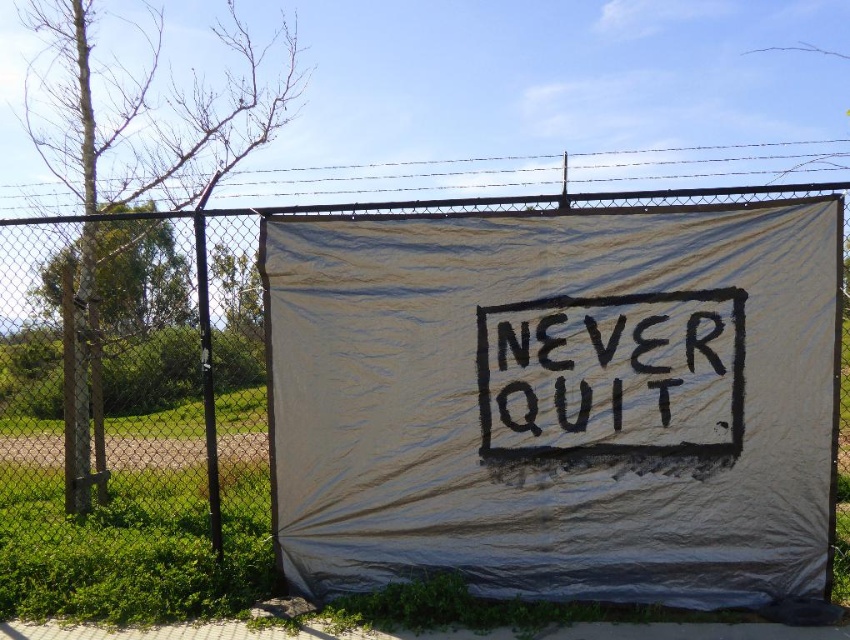
Question: Does white fabric banner at center have a greater width compared to black chalkboard at center?

Choices:
 (A) no
 (B) yes

Answer: (A)

Question: In this image, where is white fabric banner at center located relative to black chalkboard at center?

Choices:
 (A) below
 (B) above

Answer: (B)

Question: Among these points, which one is nearest to the camera?

Choices:
 (A) (848, 186)
 (B) (650, 401)

Answer: (A)

Question: Is white fabric banner at center to the left of black chalkboard at center from the viewer's perspective?

Choices:
 (A) yes
 (B) no

Answer: (B)

Question: Which point is closer to the camera?

Choices:
 (A) white fabric banner at center
 (B) black chalkboard at center

Answer: (B)

Question: Which object appears farthest from the camera in this image?

Choices:
 (A) white fabric banner at center
 (B) black chalkboard at center

Answer: (A)